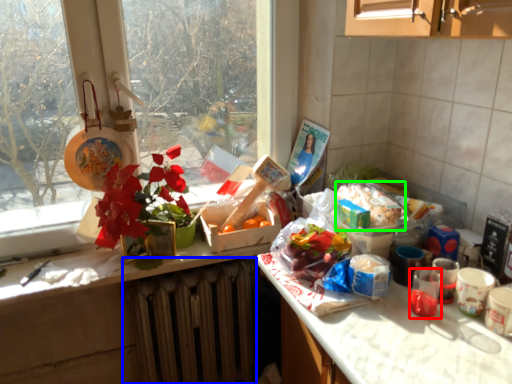
Question: Which object is positioned farthest from coffee cup (highlighted by a red box)? Select from radiator (highlighted by a blue box) and food (highlighted by a green box).

Choices:
 (A) radiator
 (B) food

Answer: (A)